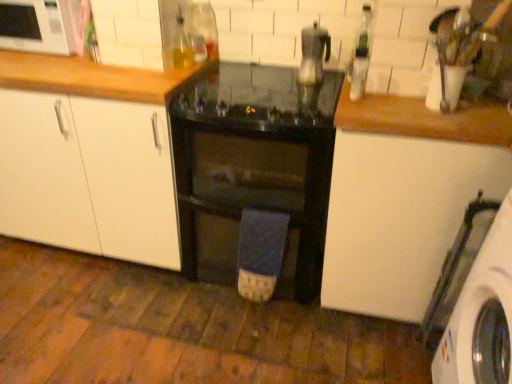
Question: Would you consider translucent glass bottle at upper center, marked as the third bottle in a right-to-left arrangement, to be distant from white matte cabinet at center, marked as the 1th cabinetry in a left-to-right arrangement?

Choices:
 (A) yes
 (B) no

Answer: (B)

Question: From the image's perspective, is translucent glass bottle at upper center, the first bottle from the left, below white matte cabinet at center, the 3th cabinetry positioned from the right?

Choices:
 (A) yes
 (B) no

Answer: (B)

Question: Does translucent glass bottle at upper center, marked as the third bottle in a right-to-left arrangement, have a lesser width compared to white matte cabinet at center, marked as the 1th cabinetry in a left-to-right arrangement?

Choices:
 (A) no
 (B) yes

Answer: (B)

Question: Does translucent glass bottle at upper center, the first bottle from the left, have a larger size compared to white matte cabinet at center, the 3th cabinetry positioned from the right?

Choices:
 (A) yes
 (B) no

Answer: (B)

Question: Is translucent glass bottle at upper center, the first bottle from the left, to the right of white matte cabinet at center, marked as the 1th cabinetry in a left-to-right arrangement, from the viewer's perspective?

Choices:
 (A) yes
 (B) no

Answer: (A)

Question: From the image's perspective, relative to translucent glass bottle at upper center, the first bottle from the left, is black glass microwave at center above or below?

Choices:
 (A) above
 (B) below

Answer: (B)

Question: Looking at their shapes, would you say black glass microwave at center is wider or thinner than translucent glass bottle at upper center, the first bottle from the left?

Choices:
 (A) thin
 (B) wide

Answer: (B)

Question: From a real-world perspective, relative to translucent glass bottle at upper center, marked as the third bottle in a right-to-left arrangement, is black glass microwave at center vertically above or below?

Choices:
 (A) below
 (B) above

Answer: (A)

Question: Relative to translucent glass bottle at upper center, the first bottle from the left, is black glass microwave at center in front or behind?

Choices:
 (A) behind
 (B) front

Answer: (B)

Question: Is translucent glass bottle at upper center, the first bottle from the left, spatially inside blue cotton bath towel at center, or outside of it?

Choices:
 (A) inside
 (B) outside

Answer: (B)

Question: In the image, is translucent glass bottle at upper center, marked as the third bottle in a right-to-left arrangement, positioned in front of or behind blue cotton bath towel at center?

Choices:
 (A) front
 (B) behind

Answer: (B)

Question: From their relative heights in the image, would you say translucent glass bottle at upper center, the first bottle from the left, is taller or shorter than blue cotton bath towel at center?

Choices:
 (A) tall
 (B) short

Answer: (B)

Question: Considering the positions of translucent glass bottle at upper center, marked as the third bottle in a right-to-left arrangement, and blue cotton bath towel at center in the image, is translucent glass bottle at upper center, marked as the third bottle in a right-to-left arrangement, wider or thinner than blue cotton bath towel at center?

Choices:
 (A) thin
 (B) wide

Answer: (B)

Question: Do you think white matte cabinet at upper right, the third cabinetry positioned from the left, is within green glass bottle at upper right, which is the 3th bottle from left to right, or outside of it?

Choices:
 (A) outside
 (B) inside

Answer: (A)

Question: In the image, is white matte cabinet at upper right, positioned as the 1th cabinetry in right-to-left order, on the left side or the right side of green glass bottle at upper right, which is the 3th bottle from left to right?

Choices:
 (A) right
 (B) left

Answer: (A)